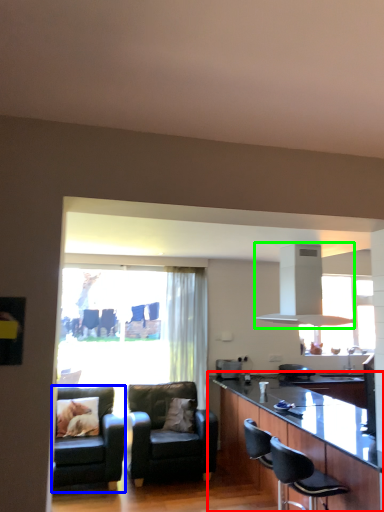
Question: Considering the real-world distances, which object is farthest from cabinetry (highlighted by a red box)? chair (highlighted by a blue box) or exhaust hood (highlighted by a green box)?

Choices:
 (A) chair
 (B) exhaust hood

Answer: (A)